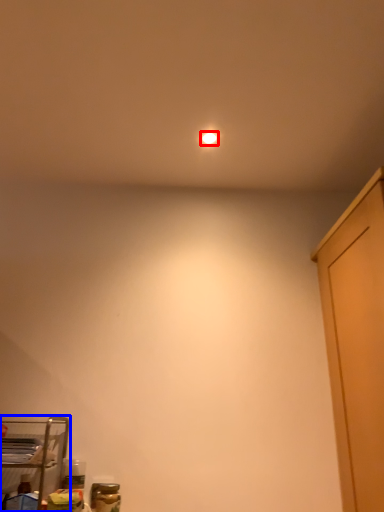
Question: Which of the following is the closest to the observer, lighting (highlighted by a red box) or furniture (highlighted by a blue box)?

Choices:
 (A) lighting
 (B) furniture

Answer: (B)